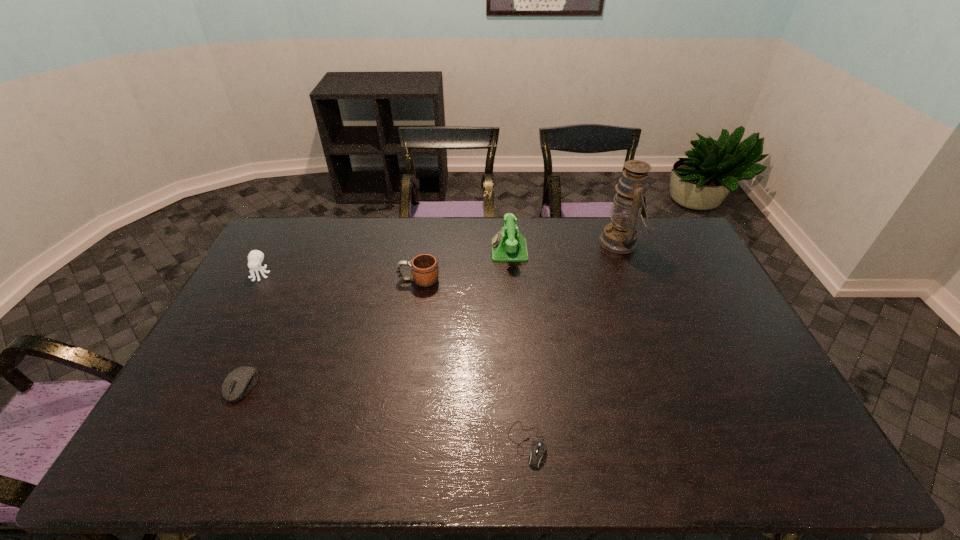
The height and width of the screenshot is (540, 960). Find the location of `free spot between the mug and the farther computer mouse`. free spot between the mug and the farther computer mouse is located at coordinates (330, 333).

The image size is (960, 540). What are the coordinates of `free point between the taller computer mouse and the tallest object` in the screenshot? It's located at (431, 314).

Find the location of `vacant space that's between the second object from left to right and the mug`. vacant space that's between the second object from left to right and the mug is located at coordinates (330, 333).

In order to click on empty location between the nearer computer mouse and the farther computer mouse in this screenshot , I will do `click(385, 415)`.

Locate an element on the screen. Image resolution: width=960 pixels, height=540 pixels. vacant area that lies between the second shortest object and the rightmost object is located at coordinates (431, 314).

Identify the location of blank region between the octopus and the mug. The width and height of the screenshot is (960, 540). (340, 278).

Identify the location of unoccupied position between the mug and the shortest object. The height and width of the screenshot is (540, 960). (473, 362).

The image size is (960, 540). Identify the location of vacant point located between the shortest object and the rightmost object. (574, 343).

You are a GUI agent. You are given a task and a screenshot of the screen. Output one action in this format:
    pyautogui.click(x=<x>, y=<y>)
    Task: Click on the free point between the rightmost object and the nearest object
    This screenshot has width=960, height=540.
    Given the screenshot: What is the action you would take?
    pyautogui.click(x=574, y=343)

Select which object is the second closest to the fifth shortest object. Please provide its 2D coordinates. Your answer should be formatted as a tuple, i.e. [(x, y)], where the tuple contains the x and y coordinates of a point satisfying the conditions above.

[(620, 236)]